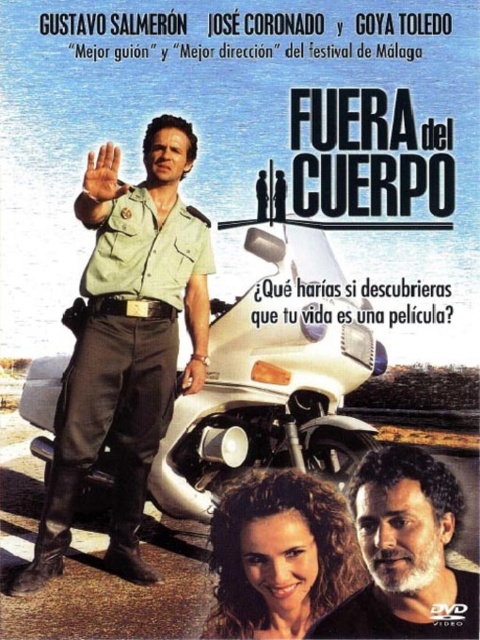
You are a photographer trying to capture the white glossy motorcycle at center and the bearded man at lower right in a single shot. Given that the motorcycle is larger in the frame, which object should you focus on first to ensure both are in focus?

The white glossy motorcycle at center is bigger than the bearded man at lower right, so you should focus on the white glossy motorcycle at center first to ensure both are in focus since it occupies more space in the frame.

Based on the movie poster for Fuera del Cuerpo, which object is placed higher in the image, the green uniform at center or the bearded man at lower right?

The green uniform at center is positioned over the bearded man at lower right, so it is higher in the image.

Based on the movie poster for Fuera del Cuerpo, there are two points marked as point 1 at coordinates point (264, 440) and point 2 at coordinates point (419, 577). Which point is closer to the viewer?

Point (264, 440) is behind point (419, 577), so point (419, 577) is closer to the viewer.